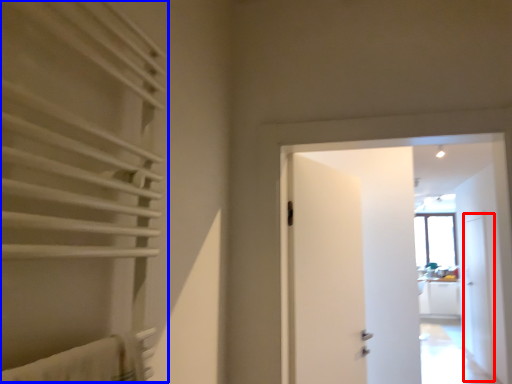
Question: Which object is closer to the camera taking this photo, screen door (highlighted by a red box) or curtain (highlighted by a blue box)?

Choices:
 (A) screen door
 (B) curtain

Answer: (B)